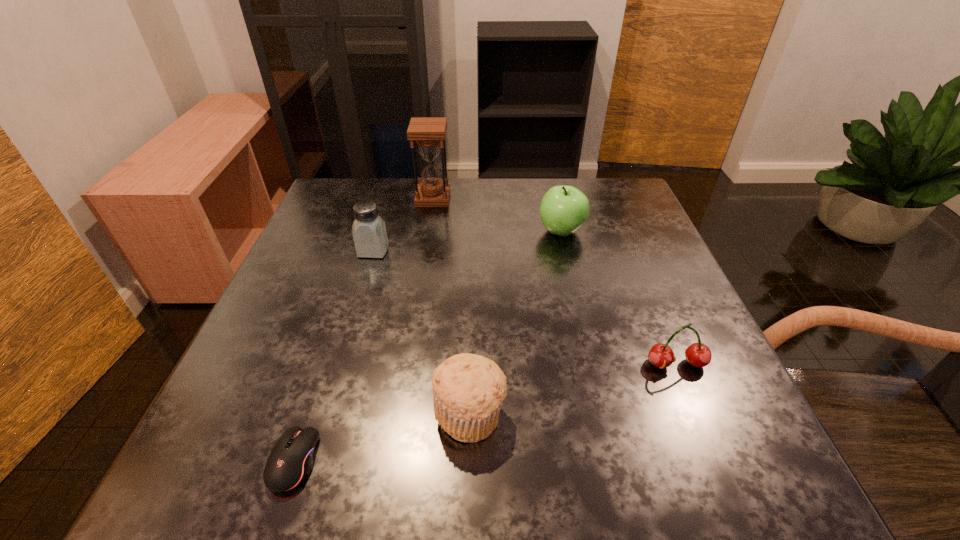
Identify the location of vacant position at the near right corner of the desktop. (686, 467).

What are the coordinates of `free space between the computer mouse and the saltshaker` in the screenshot? It's located at [333, 356].

What are the coordinates of `unoccupied position between the farthest object and the fifth object from left to right` in the screenshot? It's located at pos(497,215).

This screenshot has height=540, width=960. I want to click on free space between the fifth object from left to right and the farthest object, so click(497, 215).

At what (x,y) coordinates should I click in order to perform the action: click on free spot between the saltshaker and the third nearest object. Please return your answer as a coordinate pair (x, y). Looking at the image, I should click on (525, 308).

The height and width of the screenshot is (540, 960). Identify the location of free area in between the rightmost object and the fourth object from left to right. (573, 389).

The image size is (960, 540). In order to click on vacant area that lies between the cherry and the farthest object in this screenshot , I will do click(x=555, y=281).

This screenshot has width=960, height=540. What are the coordinates of `vacant area between the computer mouse and the apple` in the screenshot? It's located at (427, 347).

I want to click on free space between the farthest object and the computer mouse, so [x=363, y=330].

Find the location of a particular element. the third closest object to the fourth farthest object is located at coordinates (290, 462).